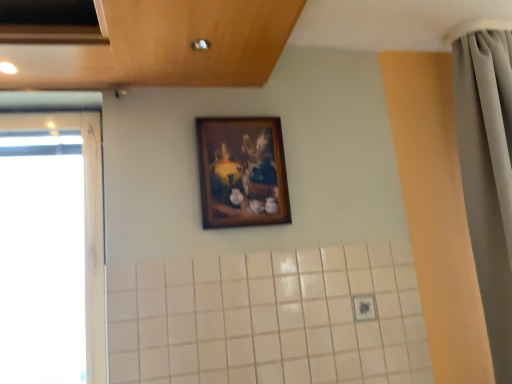
Identify the location of gray fabric shower curtain at right. (488, 176).

Which object is positioned more to the right, gray fabric shower curtain at right or wooden frame at upper center?

From the viewer's perspective, gray fabric shower curtain at right appears more on the right side.

The height and width of the screenshot is (384, 512). Find the location of `picture frame on the left of the gray fabric shower curtain at right`. picture frame on the left of the gray fabric shower curtain at right is located at coordinates (242, 172).

Could wooden frame at upper center be considered to be inside gray fabric shower curtain at right?

No, wooden frame at upper center is not surrounded by gray fabric shower curtain at right.

Can you tell me how much wooden frame at upper center and transparent glass window at left differ in facing direction?

The facing directions of wooden frame at upper center and transparent glass window at left are 0.244 degrees apart.

Is point (245, 169) more distant than point (100, 254)?

Yes, it is behind point (100, 254).

Is wooden frame at upper center wider or thinner than transparent glass window at left?

wooden frame at upper center is thinner than transparent glass window at left.

Image resolution: width=512 pixels, height=384 pixels. In order to click on picture frame lying behind the transparent glass window at left in this screenshot , I will do `click(242, 172)`.

Does transparent glass window at left have a larger size compared to gray fabric shower curtain at right?

No, transparent glass window at left is not bigger than gray fabric shower curtain at right.

Is transparent glass window at left to the left of gray fabric shower curtain at right from the viewer's perspective?

Correct, you'll find transparent glass window at left to the left of gray fabric shower curtain at right.

Is transparent glass window at left turned away from gray fabric shower curtain at right?

No, transparent glass window at left is not facing away from gray fabric shower curtain at right.

Is transparent glass window at left next to gray fabric shower curtain at right and touching it?

No, transparent glass window at left is not making contact with gray fabric shower curtain at right.

Can you confirm if wooden frame at upper center is thinner than gray fabric shower curtain at right?

Yes, wooden frame at upper center is thinner than gray fabric shower curtain at right.

Is wooden frame at upper center oriented away from gray fabric shower curtain at right?

No, wooden frame at upper center is not facing the opposite direction of gray fabric shower curtain at right.

You are a GUI agent. You are given a task and a screenshot of the screen. Output one action in this format:
    pyautogui.click(x=<x>, y=<y>)
    Task: Click on the picture frame above the gray fabric shower curtain at right (from the image's perspective)
    The width and height of the screenshot is (512, 384).
    Given the screenshot: What is the action you would take?
    pyautogui.click(x=242, y=172)

Which object is closer to the camera, wooden frame at upper center or gray fabric shower curtain at right?

Positioned in front is gray fabric shower curtain at right.

Could you tell me if gray fabric shower curtain at right is turned towards transparent glass window at left?

No, gray fabric shower curtain at right is not turned towards transparent glass window at left.

Is point (500, 131) less distant than point (92, 211)?

Yes, it is.

Do you think gray fabric shower curtain at right is within transparent glass window at left, or outside of it?

gray fabric shower curtain at right is spatially situated outside transparent glass window at left.

Which of these two, gray fabric shower curtain at right or transparent glass window at left, stands taller?

gray fabric shower curtain at right.

How distant is transparent glass window at left from wooden frame at upper center?

A distance of 22.94 inches exists between transparent glass window at left and wooden frame at upper center.

From the image's perspective, between transparent glass window at left and wooden frame at upper center, who is located below?

transparent glass window at left is shown below in the image.

Looking at this image, choose the correct answer: Is transparent glass window at left inside wooden frame at upper center or outside it?

The correct answer is: outside.

From a real-world perspective, which is physically above, transparent glass window at left or wooden frame at upper center?

wooden frame at upper center.

Identify the location of shower curtain in front of the wooden frame at upper center. click(488, 176).

Identify the location of picture frame that appears behind the transparent glass window at left. The height and width of the screenshot is (384, 512). (242, 172).

Consider the image. Based on their spatial positions, is gray fabric shower curtain at right or transparent glass window at left further from wooden frame at upper center?

Based on the image, gray fabric shower curtain at right appears to be further to wooden frame at upper center.

Based on the photo, considering their positions, is transparent glass window at left positioned further to gray fabric shower curtain at right than wooden frame at upper center?

transparent glass window at left is positioned further to the anchor gray fabric shower curtain at right.

Looking at the image, which one is located closer to wooden frame at upper center, transparent glass window at left or gray fabric shower curtain at right?

Among the two, transparent glass window at left is located nearer to wooden frame at upper center.

Based on their spatial positions, is gray fabric shower curtain at right or wooden frame at upper center closer to transparent glass window at left?

wooden frame at upper center is positioned closer to the anchor transparent glass window at left.

Based on their spatial positions, is wooden frame at upper center or transparent glass window at left further from gray fabric shower curtain at right?

Based on the image, transparent glass window at left appears to be further to gray fabric shower curtain at right.

Considering their positions, is wooden frame at upper center positioned further to transparent glass window at left than gray fabric shower curtain at right?

The object further to transparent glass window at left is gray fabric shower curtain at right.

The image size is (512, 384). Find the location of `picture frame between transparent glass window at left and gray fabric shower curtain at right`. picture frame between transparent glass window at left and gray fabric shower curtain at right is located at coordinates (242, 172).